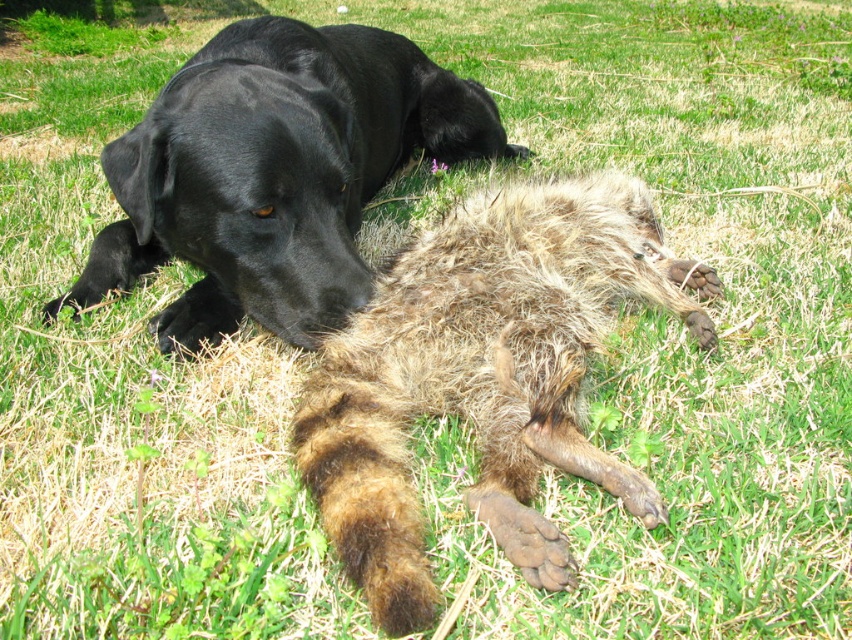
You are a dog owner trying to measure the distance between your two dogs. You have a black matte dog at upper left and a fuzzy brown fur at center. Which dog is closer to you?

The fuzzy brown fur at center is 22.83 inches away from the black matte dog at upper left. Since the question asks which dog is closer to you, but the description only provides the distance between them, we cannot determine their individual distances from the observer. However, the distance between them is 22.83 inches.

You are a photographer trying to capture both the fuzzy brown fur at center and the black matte dog at upper left in a single shot. Based on their positions, which one should you focus on first to ensure both are in focus?

The fuzzy brown fur at center is in front of the black matte dog at upper left, so you should focus on the black matte dog at upper left first to ensure both are in focus.